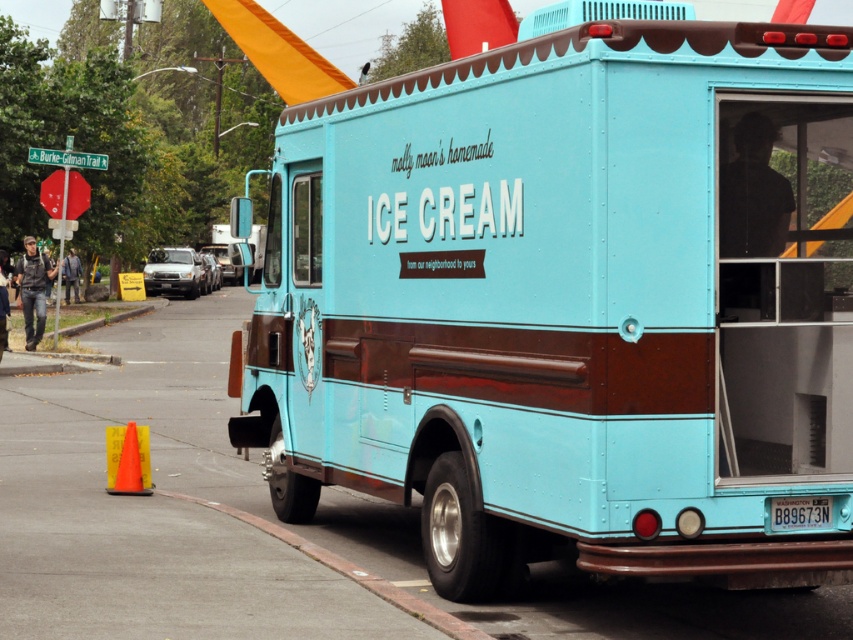
You are standing on the sidewalk and see the point at coordinates (572, 304). What object is located at that point?

The point at coordinates 0.472, 0.672 indicates the matte blue ice cream truck at center.

You are standing on the street and see the point at coordinates (x=572, y=304). What object is located at that point?

The point at coordinates (x=572, y=304) corresponds to the matte blue ice cream truck at center.